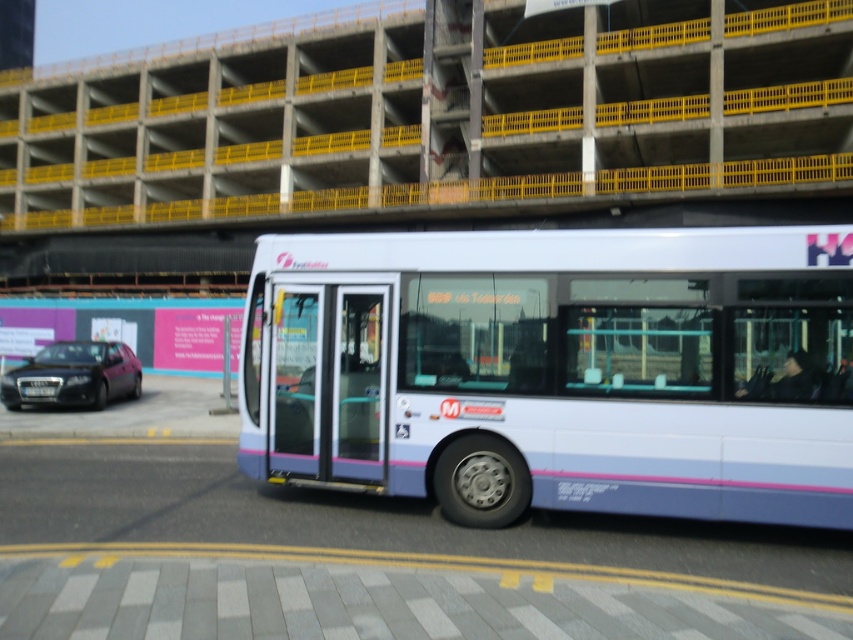
You are a city planner analyzing traffic patterns. Based on the image, what are the coordinates of the white glossy bus at center?

The white glossy bus at center is located at coordinates (558, 369).